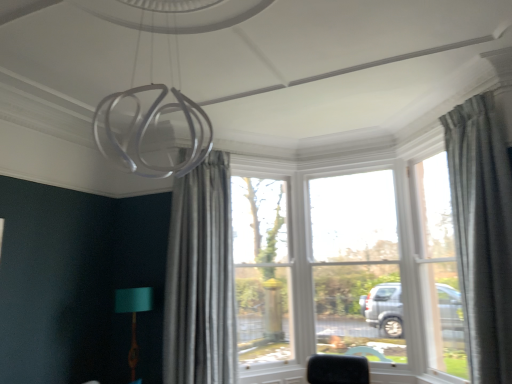
Where is `silky gray curtain at center, which is counted as the 2th curtain, starting from the front`? silky gray curtain at center, which is counted as the 2th curtain, starting from the front is located at coordinates tap(200, 278).

Find the location of a particular element. The height and width of the screenshot is (384, 512). silky gray curtain at center, the first curtain in the left-to-right sequence is located at coordinates click(200, 278).

Is textured gray curtain at right, marked as the 1th curtain in a right-to-left arrangement, not inside clear glass window at center, which ranks as the second window in right-to-left order?

Indeed, textured gray curtain at right, marked as the 1th curtain in a right-to-left arrangement, is completely outside clear glass window at center, which ranks as the second window in right-to-left order.

Measure the distance from textured gray curtain at right, arranged as the 2th curtain when viewed from the left, to clear glass window at center, which is counted as the 1th window, starting from the left.

A distance of 2.26 meters exists between textured gray curtain at right, arranged as the 2th curtain when viewed from the left, and clear glass window at center, which is counted as the 1th window, starting from the left.

Consider the image. Considering the relative sizes of textured gray curtain at right, the 2th curtain when ordered from back to front, and clear glass window at center, which is counted as the 1th window, starting from the left, in the image provided, is textured gray curtain at right, the 2th curtain when ordered from back to front, smaller than clear glass window at center, which is counted as the 1th window, starting from the left,?

Actually, textured gray curtain at right, the 2th curtain when ordered from back to front, might be larger than clear glass window at center, which is counted as the 1th window, starting from the left.

Does textured gray curtain at right, arranged as the 2th curtain when viewed from the left, have a lesser width compared to clear glass window at center, which ranks as the second window in right-to-left order?

No.

Is textured gray curtain at right, the 2th curtain when ordered from back to front, facing away from clear glass window at right, the 1th window when ordered from right to left?

No.

Who is smaller, textured gray curtain at right, arranged as the 2th curtain when viewed from the left, or clear glass window at right, the 1th window when ordered from right to left?

With smaller size is clear glass window at right, the 1th window when ordered from right to left.

Is textured gray curtain at right, the 2th curtain when ordered from back to front, in front of or behind clear glass window at right, the 2th window positioned from the left, in the image?

Clearly, textured gray curtain at right, the 2th curtain when ordered from back to front, is in front of clear glass window at right, the 2th window positioned from the left.

Is textured gray curtain at right, arranged as the 2th curtain when viewed from the left, inside the boundaries of clear glass window at right, the 2th window positioned from the left, or outside?

textured gray curtain at right, arranged as the 2th curtain when viewed from the left, is spatially situated outside clear glass window at right, the 2th window positioned from the left.

How far apart are clear glass window at right, the 1th window when ordered from right to left, and clear glass window at center, which is counted as the 1th window, starting from the left?

clear glass window at right, the 1th window when ordered from right to left, is 5.60 feet away from clear glass window at center, which is counted as the 1th window, starting from the left.

Can you confirm if clear glass window at right, the 1th window when ordered from right to left, is taller than clear glass window at center, which ranks as the second window in right-to-left order?

No.

Is clear glass window at right, the 2th window positioned from the left, placed right next to clear glass window at center, which is counted as the 1th window, starting from the left?

No, clear glass window at right, the 2th window positioned from the left, is not with clear glass window at center, which is counted as the 1th window, starting from the left.

Identify the location of window that appears above the clear glass window at center, which is counted as the 1th window, starting from the left (from a real-world perspective). Image resolution: width=512 pixels, height=384 pixels. (440, 268).

Considering the relative sizes of clear glass window at right, the 1th window when ordered from right to left, and textured gray curtain at right, marked as the 1th curtain in a right-to-left arrangement, in the image provided, is clear glass window at right, the 1th window when ordered from right to left, thinner than textured gray curtain at right, marked as the 1th curtain in a right-to-left arrangement,?

Correct, the width of clear glass window at right, the 1th window when ordered from right to left, is less than that of textured gray curtain at right, marked as the 1th curtain in a right-to-left arrangement.

Is textured gray curtain at right, marked as the 1th curtain in a right-to-left arrangement, located within clear glass window at right, the 2th window positioned from the left?

No.

From the image's perspective, is clear glass window at right, the 2th window positioned from the left, positioned above or below textured gray curtain at right, the 2th curtain when ordered from back to front?

clear glass window at right, the 2th window positioned from the left, is situated lower than textured gray curtain at right, the 2th curtain when ordered from back to front, in the image.

Is clear glass window at right, the 2th window positioned from the left, oriented towards textured gray curtain at right, arranged as the 2th curtain when viewed from the left?

No, clear glass window at right, the 2th window positioned from the left, does not turn towards textured gray curtain at right, arranged as the 2th curtain when viewed from the left.

Which point is more distant from viewer, (501, 316) or (213, 357)?

Positioned behind is point (213, 357).

Does textured gray curtain at right, marked as the 1th curtain in a front-to-back arrangement, contain silky gray curtain at center, the 2th curtain positioned from the right?

No, silky gray curtain at center, the 2th curtain positioned from the right, is not inside textured gray curtain at right, marked as the 1th curtain in a front-to-back arrangement.

Is textured gray curtain at right, the 2th curtain when ordered from back to front, smaller than silky gray curtain at center, marked as the 1th curtain in a back-to-front arrangement?

Correct, textured gray curtain at right, the 2th curtain when ordered from back to front, occupies less space than silky gray curtain at center, marked as the 1th curtain in a back-to-front arrangement.

Between textured gray curtain at right, marked as the 1th curtain in a right-to-left arrangement, and silky gray curtain at center, the first curtain in the left-to-right sequence, which one is positioned in front?

textured gray curtain at right, marked as the 1th curtain in a right-to-left arrangement, is closer to the camera.

From a real-world perspective, does silky gray curtain at center, the first curtain in the left-to-right sequence, stand above clear glass window at right, the 1th window when ordered from right to left?

No, from a real-world perspective, silky gray curtain at center, the first curtain in the left-to-right sequence, is not on top of clear glass window at right, the 1th window when ordered from right to left.

Considering the sizes of objects silky gray curtain at center, marked as the 1th curtain in a back-to-front arrangement, and clear glass window at right, the 1th window when ordered from right to left, in the image provided, who is smaller, silky gray curtain at center, marked as the 1th curtain in a back-to-front arrangement, or clear glass window at right, the 1th window when ordered from right to left,?

clear glass window at right, the 1th window when ordered from right to left, is smaller.

Is silky gray curtain at center, the 2th curtain positioned from the right, outside of clear glass window at right, the 2th window positioned from the left?

Indeed, silky gray curtain at center, the 2th curtain positioned from the right, is completely outside clear glass window at right, the 2th window positioned from the left.

The image size is (512, 384). Find the location of `curtain below the clear glass window at right, the 2th window positioned from the left (from a real-world perspective)`. curtain below the clear glass window at right, the 2th window positioned from the left (from a real-world perspective) is located at coordinates (200, 278).

Does clear glass window at right, the 1th window when ordered from right to left, have a smaller size compared to silky gray curtain at center, the 2th curtain positioned from the right?

Yes.

From the picture: Is clear glass window at right, the 2th window positioned from the left, to the left or to the right of silky gray curtain at center, which is counted as the 2th curtain, starting from the front, in the image?

clear glass window at right, the 2th window positioned from the left, is positioned on silky gray curtain at center, which is counted as the 2th curtain, starting from the front,'s right side.

Is point (448, 183) positioned behind point (210, 272)?

No, (448, 183) is closer to viewer.

Is clear glass window at right, the 1th window when ordered from right to left, taller or shorter than silky gray curtain at center, the 2th curtain positioned from the right?

Clearly, clear glass window at right, the 1th window when ordered from right to left, is shorter compared to silky gray curtain at center, the 2th curtain positioned from the right.

What are the coordinates of `the 2nd curtain in front of the clear glass window at center, which ranks as the second window in right-to-left order` in the screenshot? It's located at (482, 233).

There is a textured gray curtain at right, arranged as the 2th curtain when viewed from the left. Where is `the 1st window below it (from a real-world perspective)`? The image size is (512, 384). the 1st window below it (from a real-world perspective) is located at coordinates (440, 268).

When comparing their distances from textured gray curtain at right, marked as the 1th curtain in a right-to-left arrangement, does teal fabric lampshade at lower left or silky gray curtain at center, the 2th curtain positioned from the right, seem closer?

Among the two, silky gray curtain at center, the 2th curtain positioned from the right, is located nearer to textured gray curtain at right, marked as the 1th curtain in a right-to-left arrangement.

Looking at the image, which one is located further to textured gray curtain at right, the 2th curtain when ordered from back to front, clear glass window at center, which is counted as the 1th window, starting from the left, or silky gray curtain at center, the 2th curtain positioned from the right?

silky gray curtain at center, the 2th curtain positioned from the right, is positioned further to the anchor textured gray curtain at right, the 2th curtain when ordered from back to front.

Estimate the real-world distances between objects in this image. Which object is closer to teal fabric lampshade at lower left, clear glass window at right, the 1th window when ordered from right to left, or clear glass window at center, which ranks as the second window in right-to-left order?

Based on the image, clear glass window at center, which ranks as the second window in right-to-left order, appears to be nearer to teal fabric lampshade at lower left.

Estimate the real-world distances between objects in this image. Which object is closer to silky gray curtain at center, marked as the 1th curtain in a back-to-front arrangement, textured gray curtain at right, arranged as the 2th curtain when viewed from the left, or clear glass window at center, which is counted as the 1th window, starting from the left?

Among the two, clear glass window at center, which is counted as the 1th window, starting from the left, is located nearer to silky gray curtain at center, marked as the 1th curtain in a back-to-front arrangement.

Estimate the real-world distances between objects in this image. Which object is closer to silky gray curtain at center, marked as the 1th curtain in a back-to-front arrangement, clear glass window at center, which is counted as the 1th window, starting from the left, or textured gray curtain at right, marked as the 1th curtain in a right-to-left arrangement?

clear glass window at center, which is counted as the 1th window, starting from the left, is positioned closer to the anchor silky gray curtain at center, marked as the 1th curtain in a back-to-front arrangement.

When comparing their distances from silky gray curtain at center, the 2th curtain positioned from the right, does textured gray curtain at right, marked as the 1th curtain in a front-to-back arrangement, or clear glass window at right, the 1th window when ordered from right to left, seem closer?

clear glass window at right, the 1th window when ordered from right to left, is closer to silky gray curtain at center, the 2th curtain positioned from the right.

Considering their positions, is clear glass window at center, which is counted as the 1th window, starting from the left, positioned further to clear glass window at right, the 2th window positioned from the left, than teal fabric lampshade at lower left?

teal fabric lampshade at lower left is further to clear glass window at right, the 2th window positioned from the left.

Estimate the real-world distances between objects in this image. Which object is closer to clear glass window at center, which ranks as the second window in right-to-left order, textured gray curtain at right, arranged as the 2th curtain when viewed from the left, or clear glass window at right, the 1th window when ordered from right to left?

Among the two, clear glass window at right, the 1th window when ordered from right to left, is located nearer to clear glass window at center, which ranks as the second window in right-to-left order.

Locate an element on the screen. The width and height of the screenshot is (512, 384). window situated between teal fabric lampshade at lower left and textured gray curtain at right, arranged as the 2th curtain when viewed from the left, from left to right is located at coordinates (261, 270).

Image resolution: width=512 pixels, height=384 pixels. I want to click on curtain between silky gray curtain at center, the 2th curtain positioned from the right, and clear glass window at right, the 1th window when ordered from right to left, in the horizontal direction, so click(482, 233).

At what (x,y) coordinates should I click in order to perform the action: click on curtain located between teal fabric lampshade at lower left and textured gray curtain at right, marked as the 1th curtain in a right-to-left arrangement, in the left-right direction. Please return your answer as a coordinate pair (x, y). Looking at the image, I should click on (200, 278).

You are a GUI agent. You are given a task and a screenshot of the screen. Output one action in this format:
    pyautogui.click(x=<x>, y=<y>)
    Task: Click on the curtain between clear glass window at center, which is counted as the 1th window, starting from the left, and clear glass window at right, the 2th window positioned from the left, from left to right
    
    Given the screenshot: What is the action you would take?
    pyautogui.click(x=482, y=233)